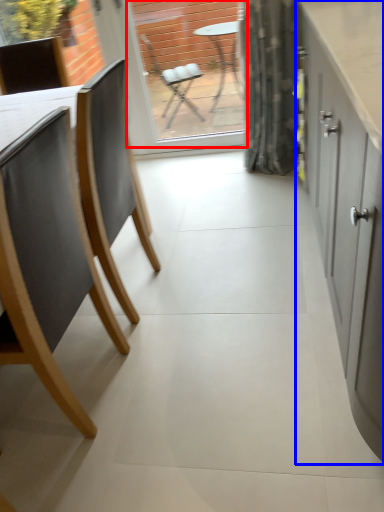
Question: Which point is further to the camera, window screen (highlighted by a red box) or cabinetry (highlighted by a blue box)?

Choices:
 (A) window screen
 (B) cabinetry

Answer: (A)